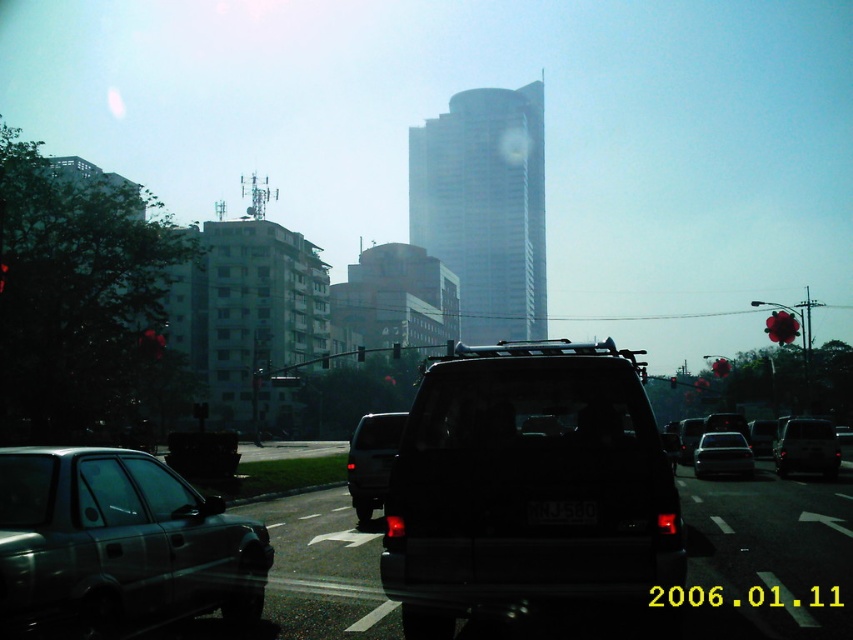
Between point (360, 442) and point (589, 524), which one is positioned behind?

Positioned behind is point (360, 442).

Is matte black suv at center further to camera compared to black plastic license plate at center?

Yes, matte black suv at center is behind black plastic license plate at center.

Between point (369, 468) and point (596, 508), which one is positioned behind?

The point (369, 468) is behind.

This screenshot has width=853, height=640. Identify the location of matte black suv at center. (370, 460).

Is black plastic license plate at center further to the viewer compared to metallic red traffic light at center?

That is False.

At what (x,y) coordinates should I click in order to perform the action: click on black plastic license plate at center. Please return your answer as a coordinate pair (x, y). The width and height of the screenshot is (853, 640). Looking at the image, I should click on (561, 513).

What do you see at coordinates (561, 513) in the screenshot? I see `black plastic license plate at center` at bounding box center [561, 513].

The height and width of the screenshot is (640, 853). Find the location of `black plastic license plate at center`. black plastic license plate at center is located at coordinates coord(561,513).

Does red plastic traffic light at right appear over metallic red traffic light at center?

Yes, red plastic traffic light at right is above metallic red traffic light at center.

Is red plastic traffic light at right below metallic red traffic light at center?

No, red plastic traffic light at right is not below metallic red traffic light at center.

The height and width of the screenshot is (640, 853). In order to click on red plastic traffic light at right in this screenshot , I will do click(x=781, y=326).